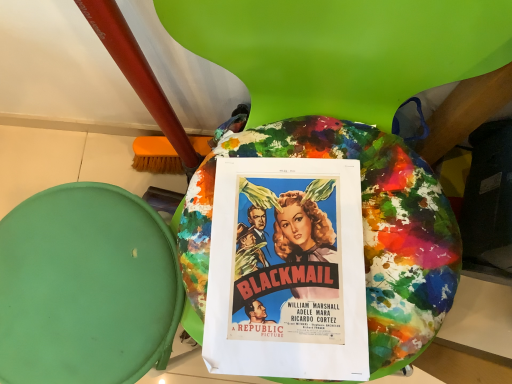
Question: Is green fabric bean bag at lower left not close to matte paper poster at center?

Choices:
 (A) yes
 (B) no

Answer: (B)

Question: From a real-world perspective, is green fabric bean bag at lower left positioned under matte paper poster at center based on gravity?

Choices:
 (A) yes
 (B) no

Answer: (A)

Question: Considering the relative sizes of green fabric bean bag at lower left and matte paper poster at center in the image provided, is green fabric bean bag at lower left bigger than matte paper poster at center?

Choices:
 (A) yes
 (B) no

Answer: (A)

Question: Is green fabric bean bag at lower left looking in the opposite direction of matte paper poster at center?

Choices:
 (A) no
 (B) yes

Answer: (A)

Question: Can you see green fabric bean bag at lower left touching matte paper poster at center?

Choices:
 (A) yes
 (B) no

Answer: (B)

Question: From a real-world perspective, is green fabric bean bag at lower left located higher than matte paper poster at center?

Choices:
 (A) yes
 (B) no

Answer: (B)

Question: From the image's perspective, is matte paper poster at center on top of green fabric bean bag at lower left?

Choices:
 (A) no
 (B) yes

Answer: (B)

Question: Considering the relative positions of matte paper poster at center and green fabric bean bag at lower left in the image provided, is matte paper poster at center to the right of green fabric bean bag at lower left from the viewer's perspective?

Choices:
 (A) no
 (B) yes

Answer: (B)

Question: Can you see matte paper poster at center touching green fabric bean bag at lower left?

Choices:
 (A) no
 (B) yes

Answer: (A)

Question: Is matte paper poster at center positioned beyond the bounds of green fabric bean bag at lower left?

Choices:
 (A) no
 (B) yes

Answer: (B)

Question: Can you confirm if matte paper poster at center is taller than green fabric bean bag at lower left?

Choices:
 (A) no
 (B) yes

Answer: (A)

Question: Is matte paper poster at center shorter than green fabric bean bag at lower left?

Choices:
 (A) no
 (B) yes

Answer: (B)

Question: Considering the positions of point (288, 256) and point (34, 379), is point (288, 256) closer or farther from the camera than point (34, 379)?

Choices:
 (A) closer
 (B) farther

Answer: (A)